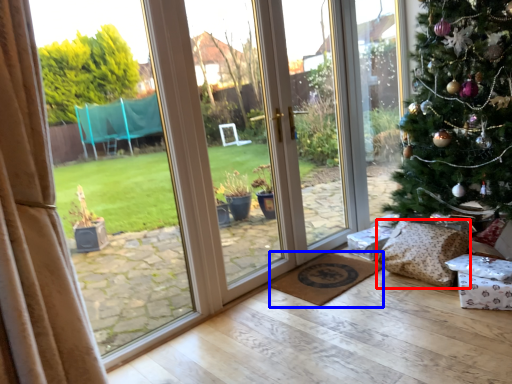
Question: Which point is closer to the camera, pillow (highlighted by a red box) or doormat (highlighted by a blue box)?

Choices:
 (A) pillow
 (B) doormat

Answer: (A)